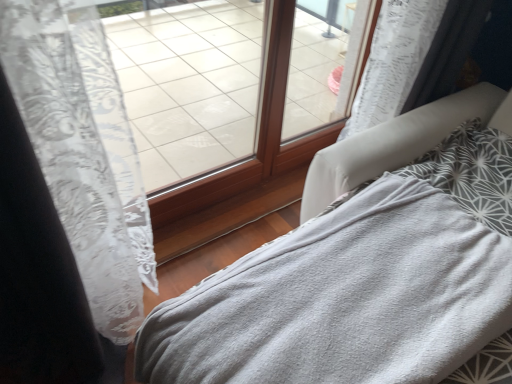
Describe the element at coordinates (257, 131) in the screenshot. The width and height of the screenshot is (512, 384). I see `transparent glass window at center, placed as the second window when sorted from right to left` at that location.

The width and height of the screenshot is (512, 384). Describe the element at coordinates (394, 143) in the screenshot. I see `gray soft blanket at lower right` at that location.

Locate an element on the screen. transparent glass window at center, the 2th window from the left is located at coordinates [x=324, y=65].

This screenshot has height=384, width=512. I want to click on transparent glass window at center, placed as the second window when sorted from right to left, so click(x=257, y=131).

Which object is further away from the camera, transparent glass window at center, acting as the first window starting from the left, or gray soft blanket at lower right?

Positioned behind is transparent glass window at center, acting as the first window starting from the left.

Can you see transparent glass window at center, placed as the second window when sorted from right to left, touching gray soft blanket at lower right?

transparent glass window at center, placed as the second window when sorted from right to left, is not next to gray soft blanket at lower right, and they're not touching.

Is transparent glass window at center, acting as the first window starting from the left, looking in the opposite direction of gray soft blanket at lower right?

No, transparent glass window at center, acting as the first window starting from the left, is not facing away from gray soft blanket at lower right.

Is transparent glass window at center, acting as the first window starting from the left, completely or partially outside of gray soft blanket at lower right?

Yes, transparent glass window at center, acting as the first window starting from the left, is located beyond the bounds of gray soft blanket at lower right.

From the image's perspective, is transparent glass window at center, the 2th window from the left, below gray soft blanket at lower right?

No, from the image's perspective, transparent glass window at center, the 2th window from the left, is not below gray soft blanket at lower right.

Is transparent glass window at center, the 2th window from the left, surrounding gray soft blanket at lower right?

No, gray soft blanket at lower right is not a part of transparent glass window at center, the 2th window from the left.

Who is shorter, transparent glass window at center, arranged as the first window when viewed from the right, or gray soft blanket at lower right?

With less height is gray soft blanket at lower right.

Is transparent glass window at center, the 2th window from the left, positioned with its back to gray soft blanket at lower right?

No, transparent glass window at center, the 2th window from the left, is not facing the opposite direction of gray soft blanket at lower right.

Is gray soft blanket at lower right oriented away from transparent glass window at center, arranged as the first window when viewed from the right?

That's not correct — gray soft blanket at lower right is not looking away from transparent glass window at center, arranged as the first window when viewed from the right.

Is point (373, 136) positioned behind point (344, 28)?

No, it is not.

From a real-world perspective, which is physically above, gray soft blanket at lower right or transparent glass window at center, arranged as the first window when viewed from the right?

transparent glass window at center, arranged as the first window when viewed from the right.

How much distance is there between gray soft blanket at lower right and transparent glass window at center, the 2th window from the left?

gray soft blanket at lower right is 22.21 inches away from transparent glass window at center, the 2th window from the left.

Does point (351, 2) come farther from viewer compared to point (328, 136)?

No, it is not.

Can you confirm if transparent glass window at center, the 2th window from the left, is wider than transparent glass window at center, placed as the second window when sorted from right to left?

No, transparent glass window at center, the 2th window from the left, is not wider than transparent glass window at center, placed as the second window when sorted from right to left.

Is transparent glass window at center, the 2th window from the left, not close to transparent glass window at center, placed as the second window when sorted from right to left?

transparent glass window at center, the 2th window from the left, is near transparent glass window at center, placed as the second window when sorted from right to left, not far away.

Considering the relative sizes of gray soft blanket at lower right and transparent glass window at center, placed as the second window when sorted from right to left, in the image provided, is gray soft blanket at lower right shorter than transparent glass window at center, placed as the second window when sorted from right to left,?

Yes.

From a real-world perspective, between gray soft blanket at lower right and transparent glass window at center, placed as the second window when sorted from right to left, who is vertically higher?

From a 3D spatial view, transparent glass window at center, placed as the second window when sorted from right to left, is above.

Where is `furniture below the transparent glass window at center, placed as the second window when sorted from right to left (from the image's perspective)`? Image resolution: width=512 pixels, height=384 pixels. furniture below the transparent glass window at center, placed as the second window when sorted from right to left (from the image's perspective) is located at coordinates (394, 143).

From the picture: Is gray soft blanket at lower right completely or partially outside of transparent glass window at center, placed as the second window when sorted from right to left?

Yes, gray soft blanket at lower right is located beyond the bounds of transparent glass window at center, placed as the second window when sorted from right to left.

Is transparent glass window at center, placed as the second window when sorted from right to left, further to camera compared to transparent glass window at center, arranged as the first window when viewed from the right?

No, transparent glass window at center, placed as the second window when sorted from right to left, is closer to the camera.

From the image's perspective, would you say transparent glass window at center, placed as the second window when sorted from right to left, is positioned over transparent glass window at center, the 2th window from the left?

No, from the image's perspective, transparent glass window at center, placed as the second window when sorted from right to left, is not over transparent glass window at center, the 2th window from the left.

Does transparent glass window at center, acting as the first window starting from the left, have a greater width compared to transparent glass window at center, arranged as the first window when viewed from the right?

Yes, transparent glass window at center, acting as the first window starting from the left, is wider than transparent glass window at center, arranged as the first window when viewed from the right.

Is transparent glass window at center, placed as the second window when sorted from right to left, at the right side of transparent glass window at center, arranged as the first window when viewed from the right?

Incorrect, transparent glass window at center, placed as the second window when sorted from right to left, is not on the right side of transparent glass window at center, arranged as the first window when viewed from the right.

You are a GUI agent. You are given a task and a screenshot of the screen. Output one action in this format:
    pyautogui.click(x=<x>, y=<y>)
    Task: Click on the furniture located on the right of transparent glass window at center, placed as the second window when sorted from right to left
    The image size is (512, 384).
    Given the screenshot: What is the action you would take?
    pyautogui.click(x=394, y=143)

The image size is (512, 384). In order to click on furniture below the transparent glass window at center, the 2th window from the left (from a real-world perspective) in this screenshot , I will do tap(394, 143).

Considering their positions, is gray soft blanket at lower right positioned closer to transparent glass window at center, placed as the second window when sorted from right to left, than transparent glass window at center, arranged as the first window when viewed from the right?

transparent glass window at center, arranged as the first window when viewed from the right, is positioned closer to the anchor transparent glass window at center, placed as the second window when sorted from right to left.

Consider the image. Considering their positions, is transparent glass window at center, the 2th window from the left, positioned further to gray soft blanket at lower right than transparent glass window at center, acting as the first window starting from the left?

The object further to gray soft blanket at lower right is transparent glass window at center, the 2th window from the left.

From the image, which object appears to be nearer to transparent glass window at center, acting as the first window starting from the left, transparent glass window at center, the 2th window from the left, or gray soft blanket at lower right?

transparent glass window at center, the 2th window from the left.

Looking at the image, which one is located further to gray soft blanket at lower right, transparent glass window at center, acting as the first window starting from the left, or transparent glass window at center, arranged as the first window when viewed from the right?

transparent glass window at center, arranged as the first window when viewed from the right, is further to gray soft blanket at lower right.

Considering their positions, is transparent glass window at center, acting as the first window starting from the left, positioned closer to transparent glass window at center, arranged as the first window when viewed from the right, than gray soft blanket at lower right?

transparent glass window at center, acting as the first window starting from the left, lies closer to transparent glass window at center, arranged as the first window when viewed from the right, than the other object.

Based on their spatial positions, is gray soft blanket at lower right or transparent glass window at center, placed as the second window when sorted from right to left, closer to transparent glass window at center, arranged as the first window when viewed from the right?

transparent glass window at center, placed as the second window when sorted from right to left.

Identify the location of window between gray soft blanket at lower right and transparent glass window at center, arranged as the first window when viewed from the right, from front to back. This screenshot has width=512, height=384. (257, 131).